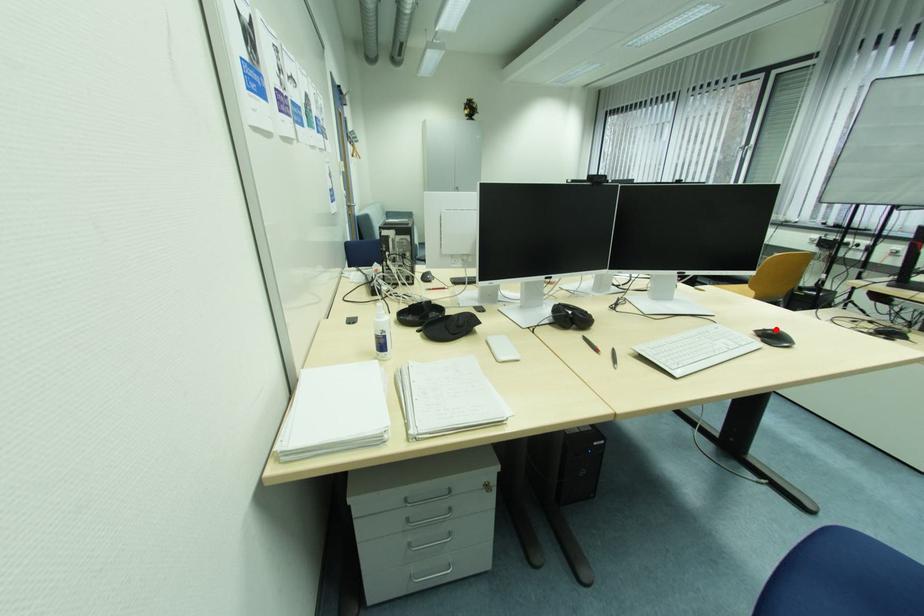
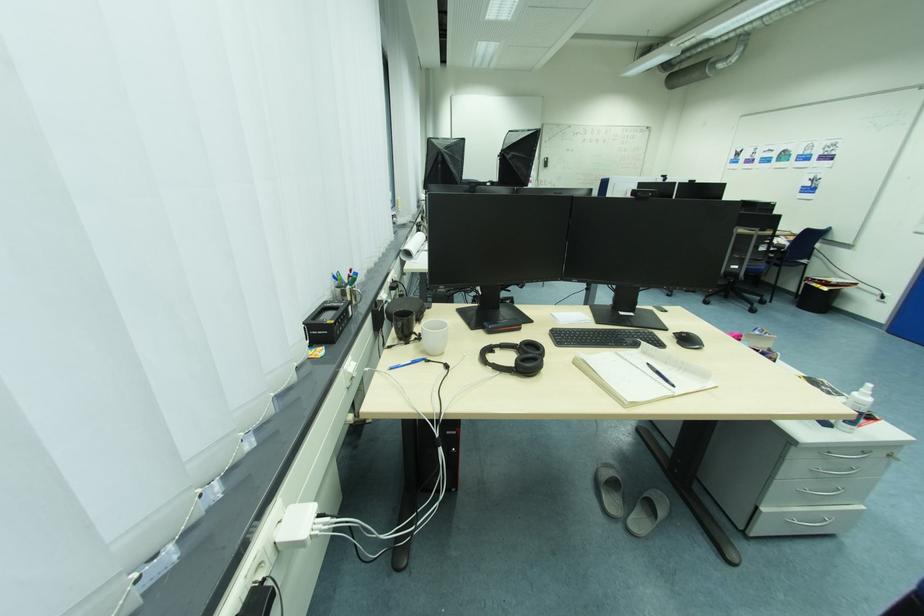
Question: I am providing you with two images of the same scene from different viewpoints. A red point is marked on the first image. At the location where the point appears in image 1, is it still visible in image 2?

Choices:
 (A) Yes
 (B) No

Answer: (B)